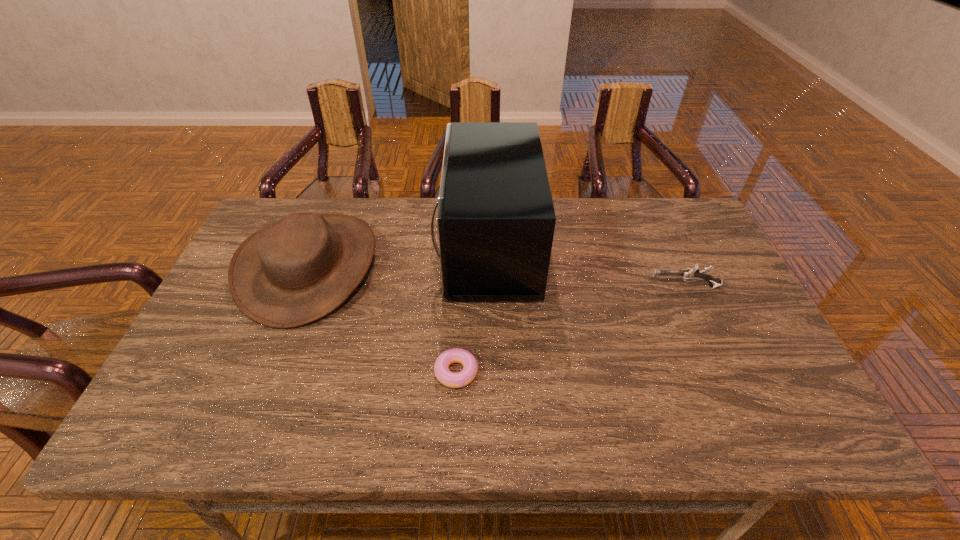
Where is `vacant space at the far edge of the desktop`? Image resolution: width=960 pixels, height=540 pixels. vacant space at the far edge of the desktop is located at coordinates (599, 233).

This screenshot has height=540, width=960. I want to click on blank area at the near edge, so click(x=394, y=433).

Where is `free region at the right edge`? The height and width of the screenshot is (540, 960). free region at the right edge is located at coordinates (719, 334).

This screenshot has height=540, width=960. What are the coordinates of `vacant point at the far left corner` in the screenshot? It's located at (287, 199).

Where is `vacant space at the far right corner of the desktop`? vacant space at the far right corner of the desktop is located at coordinates (682, 215).

I want to click on free space at the near right corner, so click(x=787, y=410).

Image resolution: width=960 pixels, height=540 pixels. What are the coordinates of `vacant point located between the rightmost object and the shortest object` in the screenshot? It's located at (570, 329).

At what (x,y) coordinates should I click in order to perform the action: click on vacant point located between the cowboy hat and the nearest object. Please return your answer as a coordinate pair (x, y). Looking at the image, I should click on (383, 319).

At what (x,y) coordinates should I click in order to perform the action: click on free space between the microwave oven and the leftmost object. Please return your answer as a coordinate pair (x, y). Looking at the image, I should click on (398, 256).

At what (x,y) coordinates should I click in order to perform the action: click on free space between the third tallest object and the nearest object. Please return your answer as a coordinate pair (x, y). The height and width of the screenshot is (540, 960). Looking at the image, I should click on (570, 329).